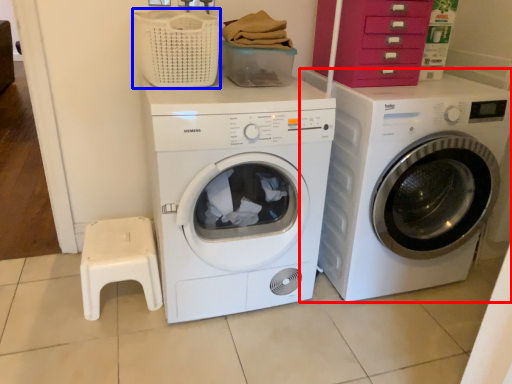
Question: Which point is closer to the camera, washing machine (highlighted by a red box) or basket (highlighted by a blue box)?

Choices:
 (A) washing machine
 (B) basket

Answer: (B)